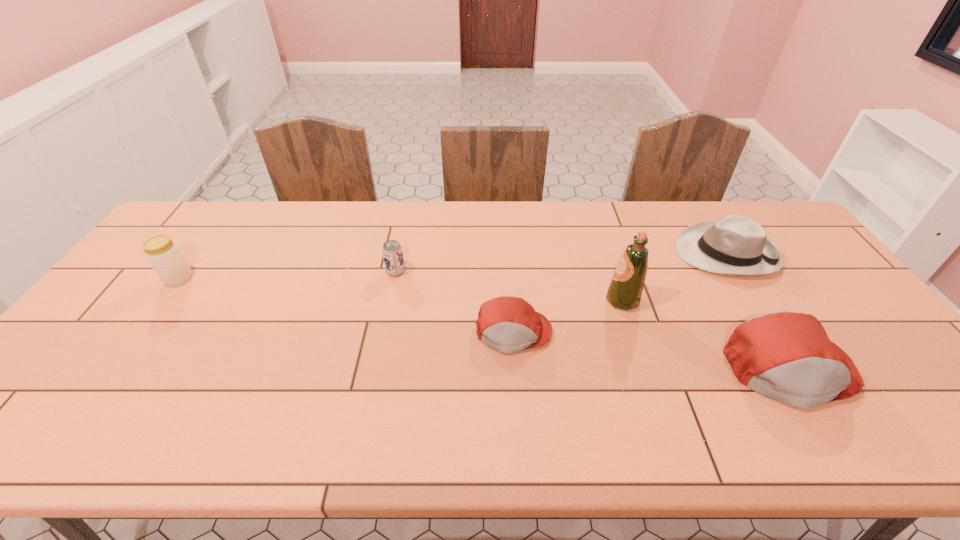
Image resolution: width=960 pixels, height=540 pixels. Identify the location of unoccupied position between the fedora and the fifth object from right to left. (561, 262).

Where is `vacant area between the olive oil and the fourth object from right to left`? vacant area between the olive oil and the fourth object from right to left is located at coordinates (568, 316).

You are a GUI agent. You are given a task and a screenshot of the screen. Output one action in this format:
    pyautogui.click(x=<x>, y=<y>)
    Task: Click on the vacant space that is in between the left cap and the beer can
    
    Given the screenshot: What is the action you would take?
    pyautogui.click(x=455, y=302)

The image size is (960, 540). What are the coordinates of `empty space between the tallest object and the shorter cap` in the screenshot? It's located at (568, 316).

The width and height of the screenshot is (960, 540). What are the coordinates of `free space that is in between the olive oil and the beer can` in the screenshot? It's located at (509, 286).

Locate an element on the screen. The height and width of the screenshot is (540, 960). free space that is in between the taller cap and the third object from right to left is located at coordinates (706, 335).

Identify the location of vacant area that lies between the leftmost object and the beer can. The width and height of the screenshot is (960, 540). (287, 275).

I want to click on free space that is in between the tallest object and the left cap, so click(x=568, y=316).

Where is `vacant region between the leftmost object and the shorter cap`? The height and width of the screenshot is (540, 960). vacant region between the leftmost object and the shorter cap is located at coordinates (346, 306).

Identify the location of free space between the leftmost object and the fourth object from right to left. Image resolution: width=960 pixels, height=540 pixels. (346, 306).